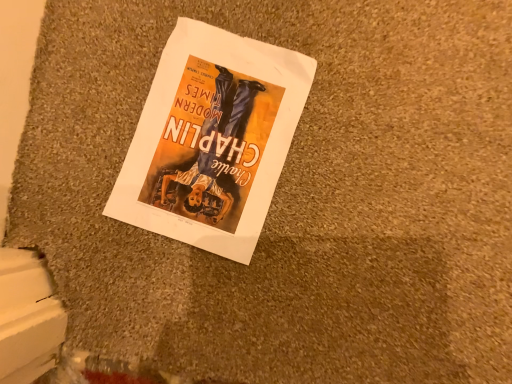
This screenshot has height=384, width=512. I want to click on free space above matte paper poster at center (from a real-world perspective), so [x=212, y=137].